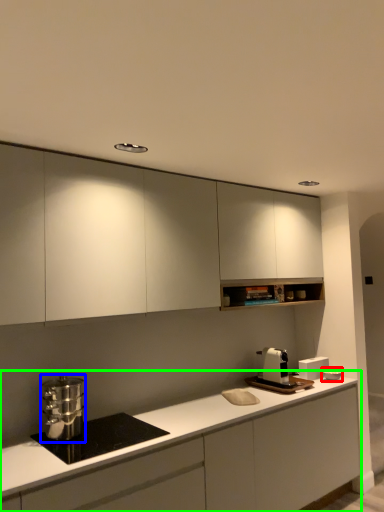
Question: Which object is positioned farthest from appliance (highlighted by a red box)? Select from kitchen appliance (highlighted by a blue box) and cabinetry (highlighted by a green box).

Choices:
 (A) kitchen appliance
 (B) cabinetry

Answer: (A)